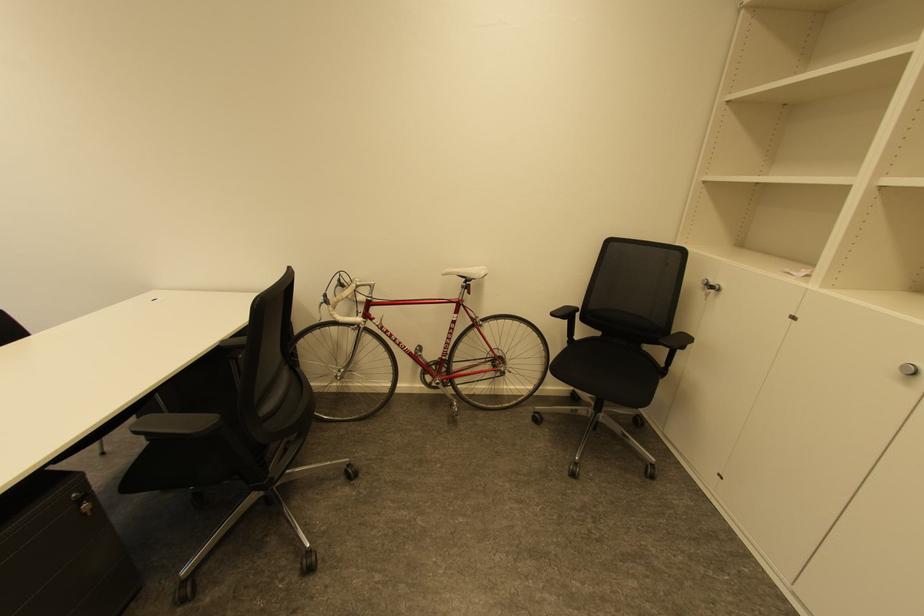
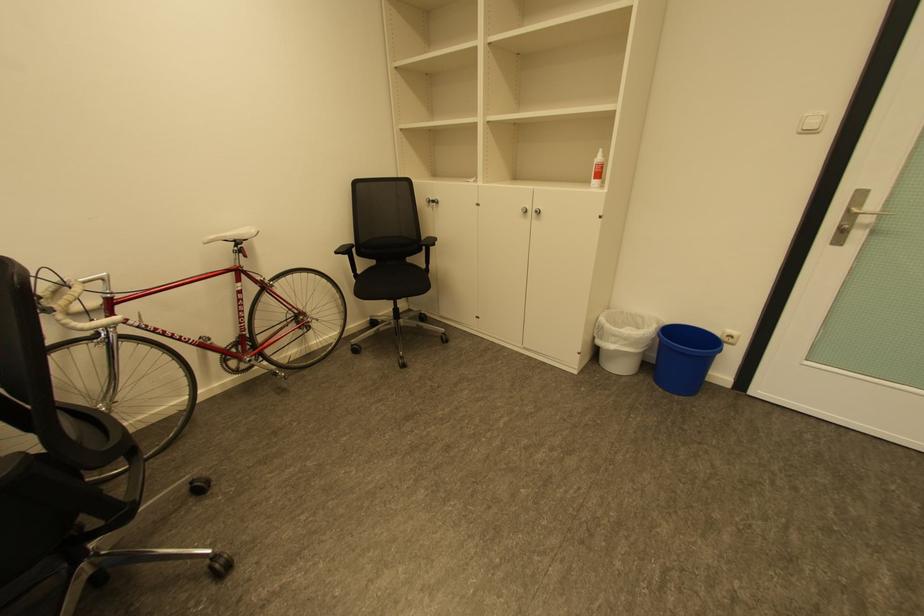
Locate, in the second image, the point that corresponds to point (708, 282) in the first image.

(432, 201)